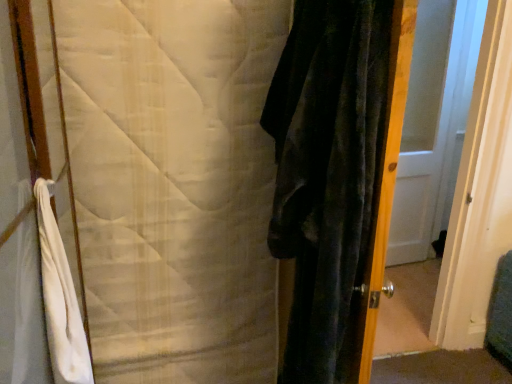
Question: Considering the relative positions of white quilted blanket at left and white glossy door at center in the image provided, is white quilted blanket at left to the right of white glossy door at center from the viewer's perspective?

Choices:
 (A) no
 (B) yes

Answer: (A)

Question: Does white quilted blanket at left have a greater height compared to white glossy door at center?

Choices:
 (A) no
 (B) yes

Answer: (A)

Question: Does white quilted blanket at left have a lesser width compared to white glossy door at center?

Choices:
 (A) yes
 (B) no

Answer: (B)

Question: Is white quilted blanket at left facing away from white glossy door at center?

Choices:
 (A) yes
 (B) no

Answer: (B)

Question: From the image's perspective, is white quilted blanket at left over white glossy door at center?

Choices:
 (A) no
 (B) yes

Answer: (A)

Question: From the image's perspective, would you say white quilted blanket at left is shown under white glossy door at center?

Choices:
 (A) yes
 (B) no

Answer: (A)

Question: Is white glossy door at center beside velvet dark green screen door at right?

Choices:
 (A) yes
 (B) no

Answer: (B)

Question: Could you tell me if white glossy door at center is facing velvet dark green screen door at right?

Choices:
 (A) no
 (B) yes

Answer: (A)

Question: Considering the relative positions of white glossy door at center and velvet dark green screen door at right in the image provided, is white glossy door at center to the right of velvet dark green screen door at right from the viewer's perspective?

Choices:
 (A) no
 (B) yes

Answer: (B)

Question: Considering the relative sizes of white glossy door at center and velvet dark green screen door at right in the image provided, is white glossy door at center thinner than velvet dark green screen door at right?

Choices:
 (A) no
 (B) yes

Answer: (B)

Question: Considering the relative sizes of white glossy door at center and velvet dark green screen door at right in the image provided, is white glossy door at center taller than velvet dark green screen door at right?

Choices:
 (A) no
 (B) yes

Answer: (B)

Question: From the image's perspective, is white glossy door at center beneath velvet dark green screen door at right?

Choices:
 (A) no
 (B) yes

Answer: (A)

Question: Is velvet dark green screen door at right located outside white quilted blanket at left?

Choices:
 (A) yes
 (B) no

Answer: (A)